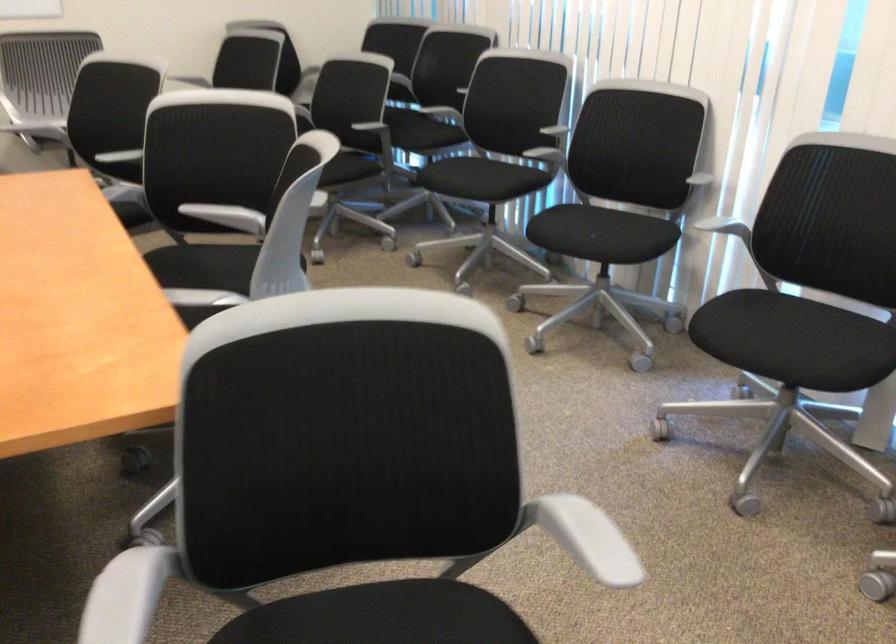
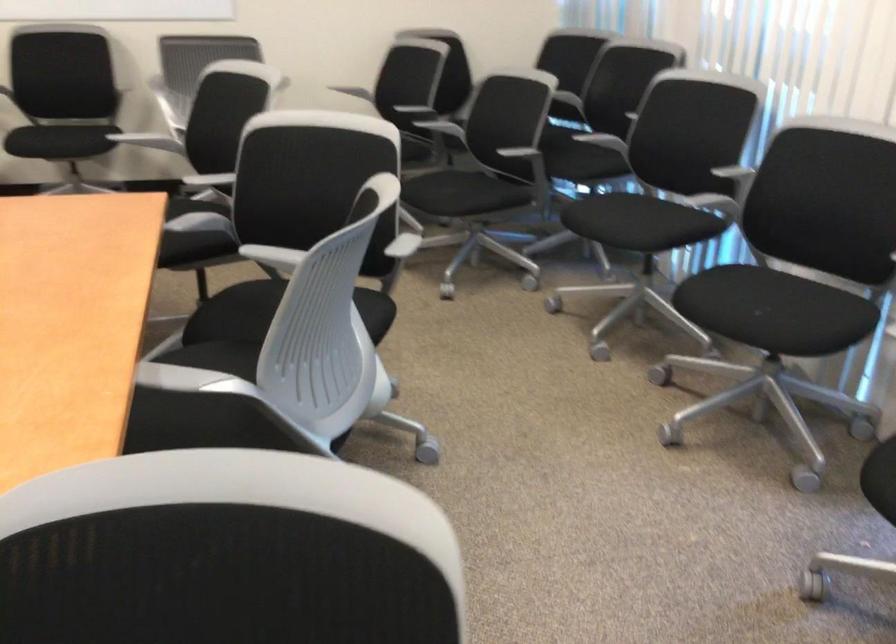
In the second image, find the point that corresponds to point 684,390 in the first image.

(858, 527)